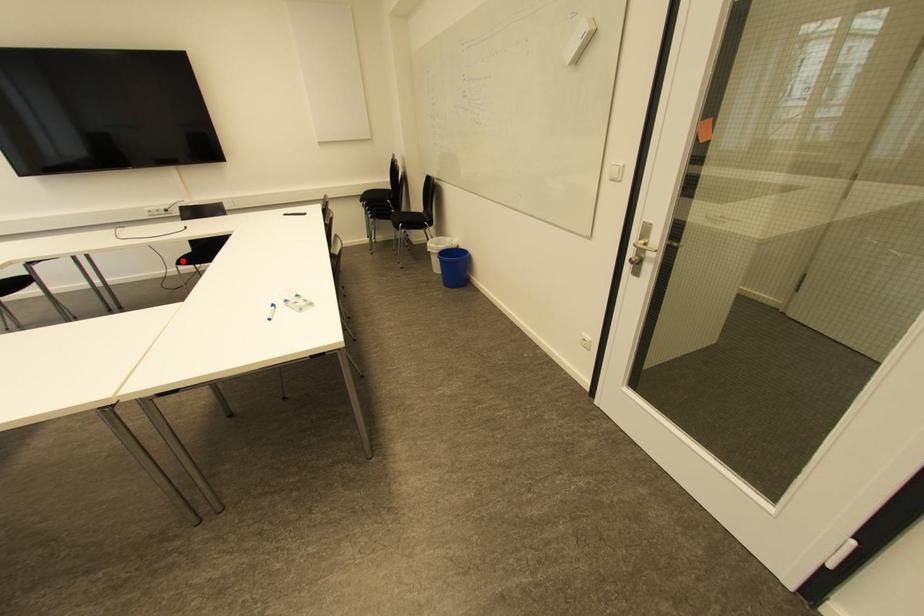
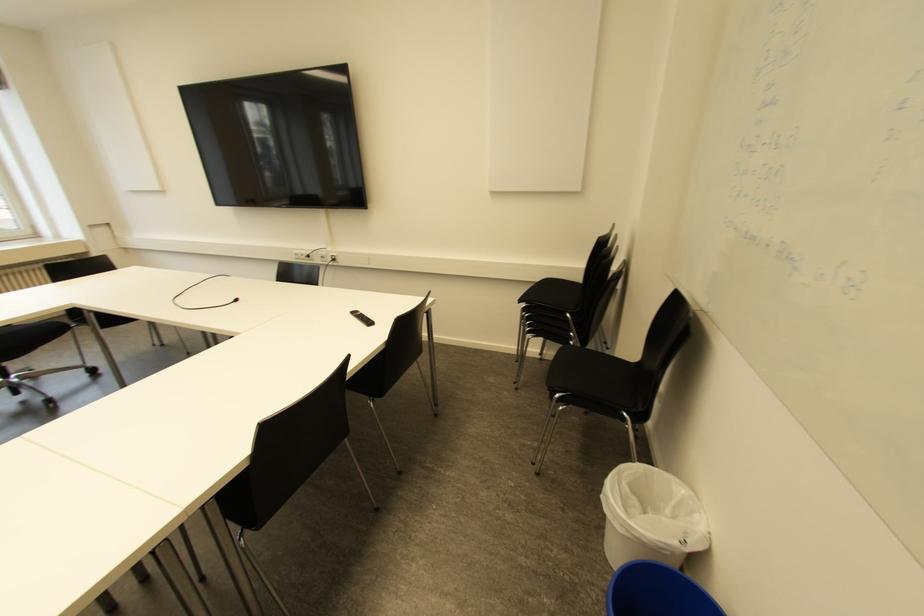
Question: I am providing you with two images of the same scene from different viewpoints. A red point is marked on the first image. At the location where the point appears in image 1, is it still visible in image 2?

Choices:
 (A) Yes
 (B) No

Answer: (B)